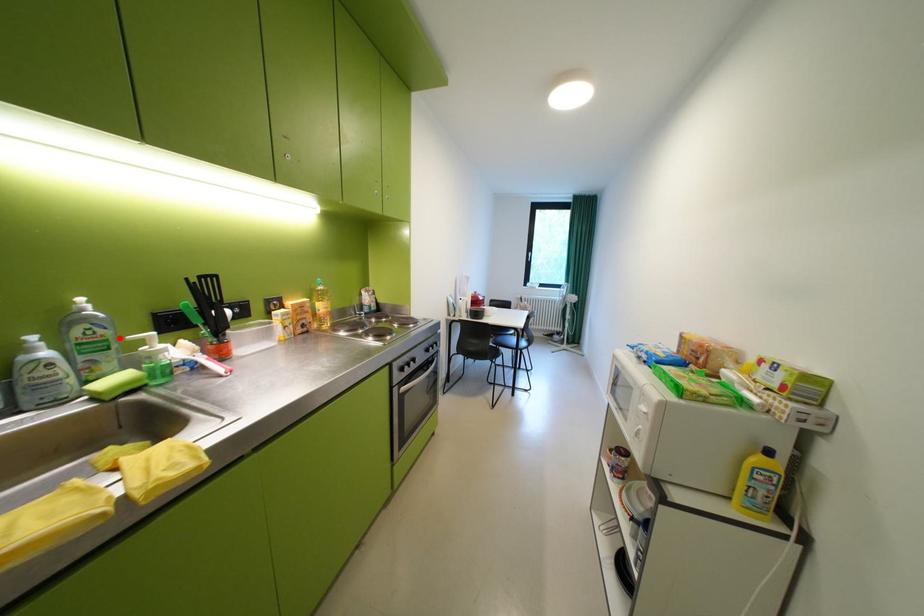
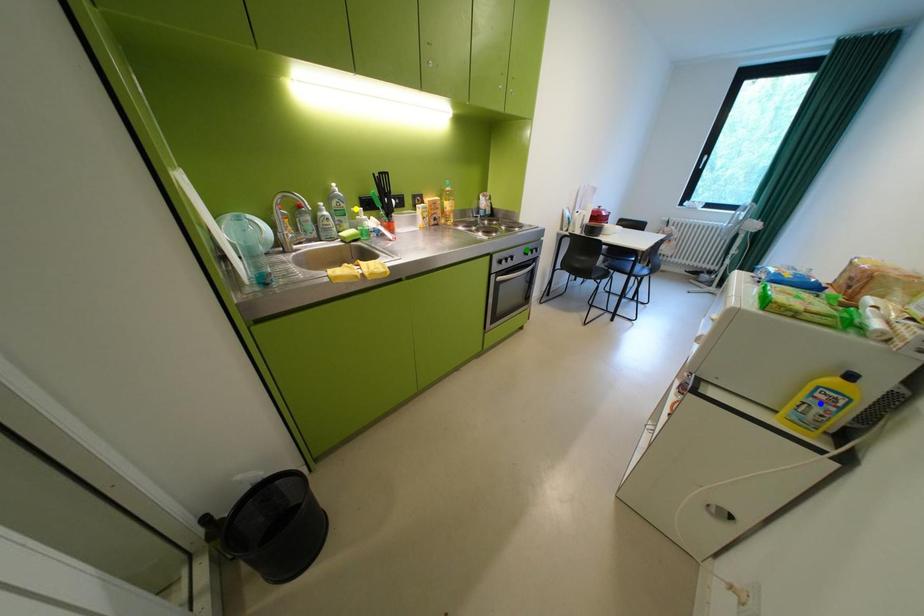
Question: I am providing you with two images of the same scene from different viewpoints. A red point is marked on the first image. You are given multiple points on the second image. Which point in image 2 is actually the same real-world point as the red point in image 1?

Choices:
 (A) yellow point
 (B) blue point
 (C) green point

Answer: (A)